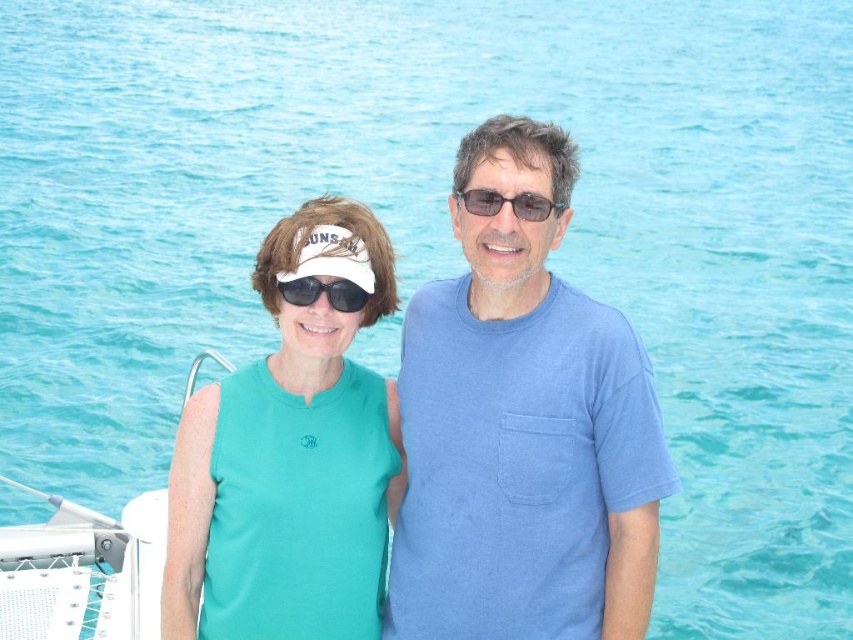
You are a photographer trying to capture both the teal fabric visor at left and the black reflective sunglasses at center in the same frame. Given that your camera has a minimum focus distance of 8 feet, will you be able to focus on both objects simultaneously?

The teal fabric visor at left and the black reflective sunglasses at center are 9.20 feet apart, which exceeds the camera minimum focus distance of 8 feet. Therefore, you can focus on both objects simultaneously.

You are a photographer trying to capture a closeup shot of both the teal fabric visor at left and the glossy plastic sunglasses at center. The camera you have can only focus on objects within a 5 meter range. Will you be able to include both items in a single focused shot?

The distance between the teal fabric visor at left and the glossy plastic sunglasses at center is 5.26 meters, which exceeds the camera focus range of 5 meters. Therefore, you cannot include both items in a single focused shot.